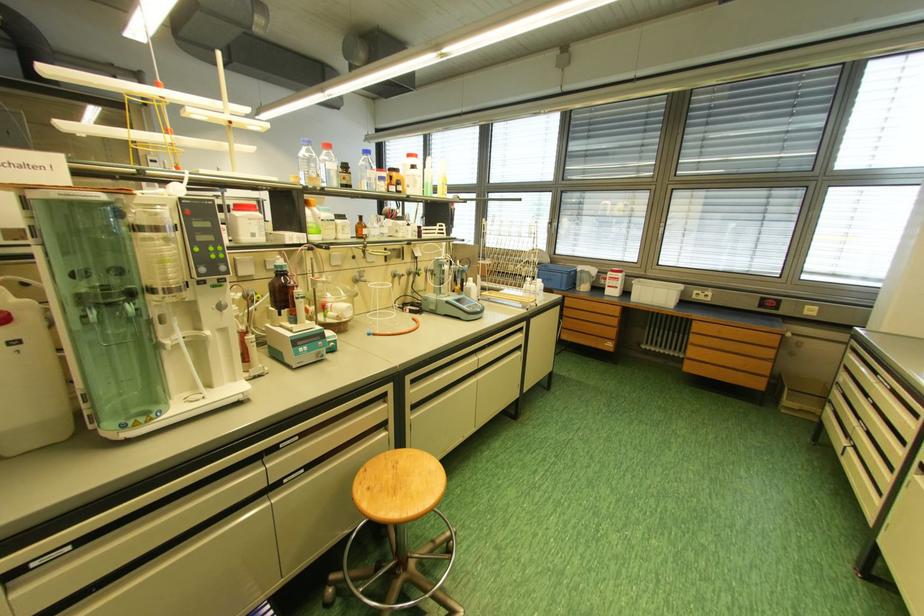
This screenshot has height=616, width=924. Find the location of `white wash bottle`. white wash bottle is located at coordinates (30, 379).